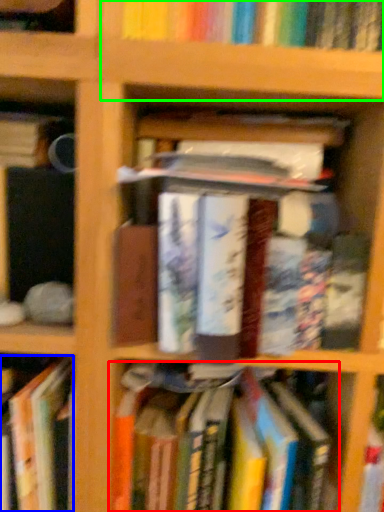
Question: Which is nearer to the book (highlighted by a red box)? book (highlighted by a blue box) or shelf (highlighted by a green box).

Choices:
 (A) book
 (B) shelf

Answer: (A)